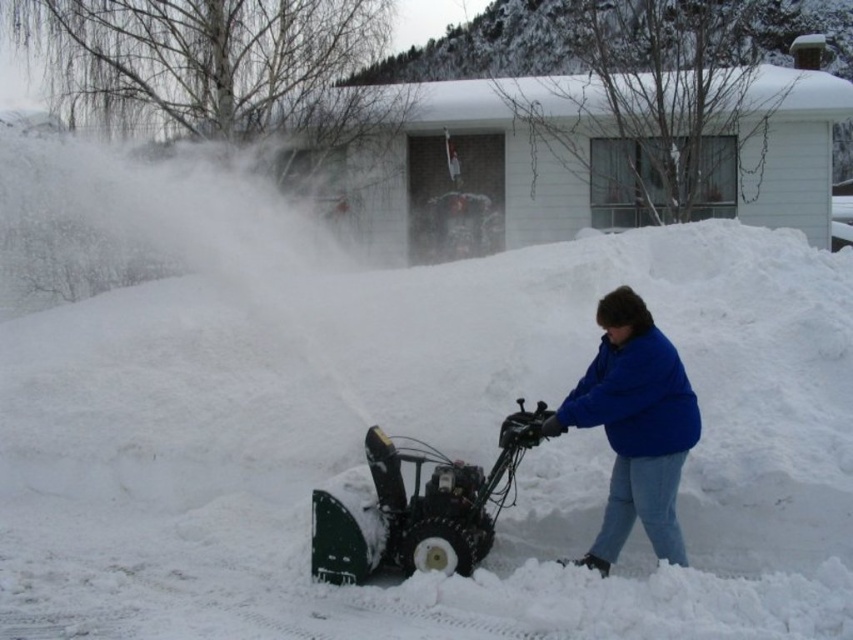
Is white fluffy snow at center below green plastic snow blower at center?

Actually, white fluffy snow at center is above green plastic snow blower at center.

Can you confirm if white fluffy snow at center is positioned to the left of green plastic snow blower at center?

Correct, you'll find white fluffy snow at center to the left of green plastic snow blower at center.

You are a GUI agent. You are given a task and a screenshot of the screen. Output one action in this format:
    pyautogui.click(x=<x>, y=<y>)
    Task: Click on the white fluffy snow at center
    This screenshot has height=640, width=853.
    Given the screenshot: What is the action you would take?
    pyautogui.click(x=431, y=444)

Locate an element on the screen. The width and height of the screenshot is (853, 640). white fluffy snow at center is located at coordinates (431, 444).

Can you confirm if white fluffy snow at center is positioned below blue fleece jacket at lower right?

No, white fluffy snow at center is not below blue fleece jacket at lower right.

Does white fluffy snow at center appear over blue fleece jacket at lower right?

Correct, white fluffy snow at center is located above blue fleece jacket at lower right.

Who is more distant from viewer, [660,257] or [646,394]?

Point [660,257]

Where is `white fluffy snow at center`? This screenshot has width=853, height=640. white fluffy snow at center is located at coordinates (431, 444).

Is blue fleece jacket at lower right shorter than green plastic snow blower at center?

No, blue fleece jacket at lower right is not shorter than green plastic snow blower at center.

Does point (610, 332) come in front of point (500, 426)?

Yes, it is in front of point (500, 426).

Locate an element on the screen. The image size is (853, 640). blue fleece jacket at lower right is located at coordinates (634, 426).

Locate an element on the screen. blue fleece jacket at lower right is located at coordinates (634, 426).